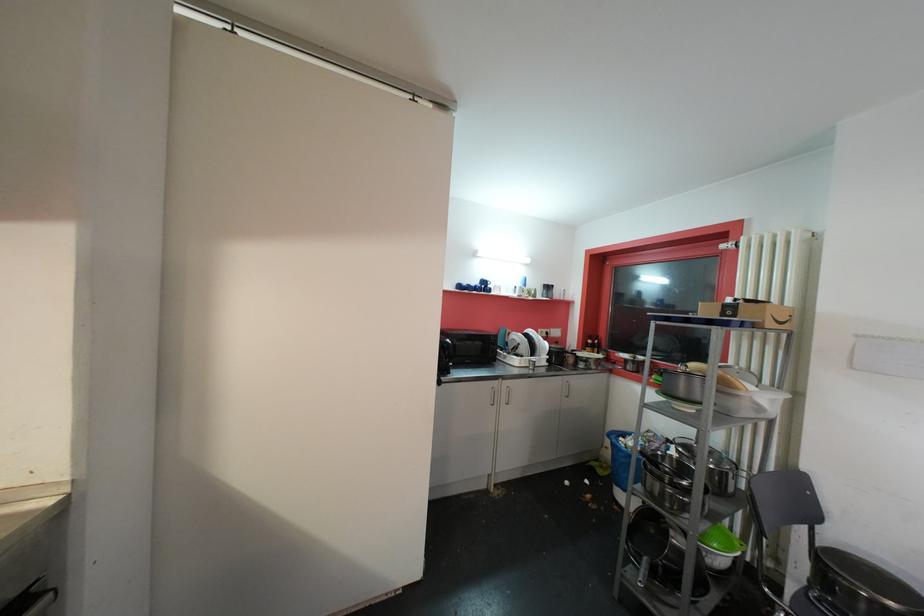
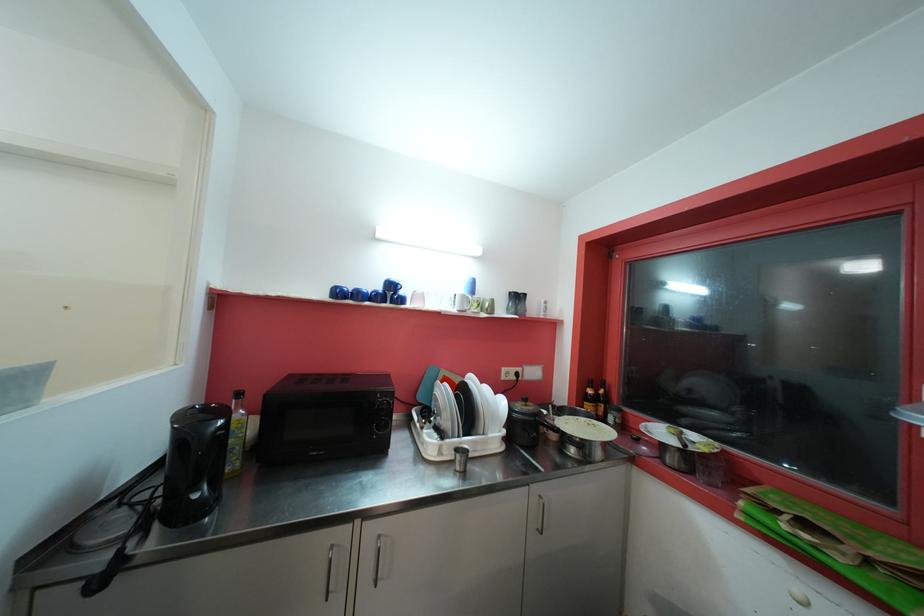
The images are taken continuously from a first-person perspective. In which direction are you moving?

The cameraman moved toward right, forward.